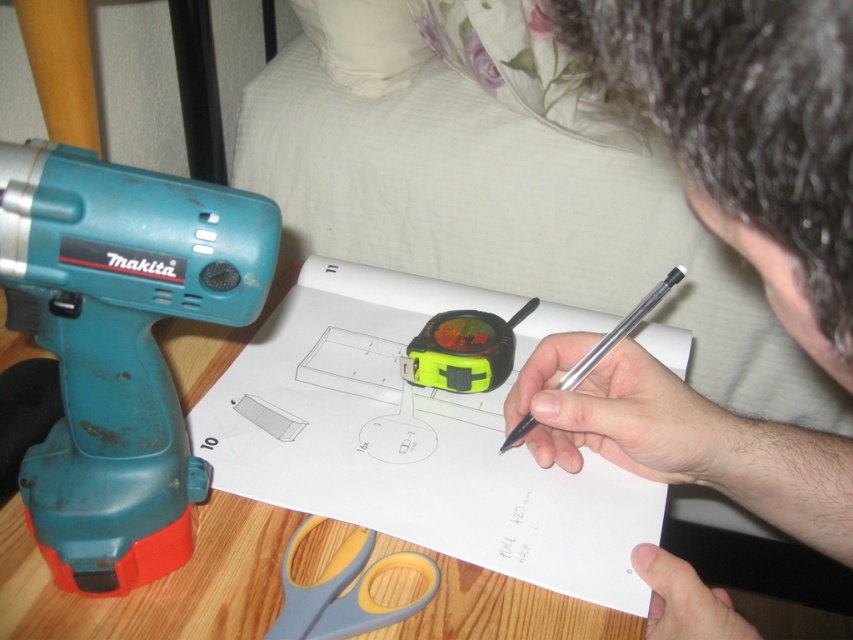
Which of these two, dark brown hair at upper right or yellow-green plastic tape measure at center, stands shorter?

yellow-green plastic tape measure at center

Consider the image. Which is more to the right, dark brown hair at upper right or yellow-green plastic tape measure at center?

Positioned to the right is dark brown hair at upper right.

What do you see at coordinates (747, 134) in the screenshot? I see `dark brown hair at upper right` at bounding box center [747, 134].

Identify the location of dark brown hair at upper right. The width and height of the screenshot is (853, 640). (747, 134).

Who is higher up, yellow/grey plastic scissors at lower left or silver metallic pen at center?

Positioned higher is silver metallic pen at center.

Who is positioned more to the left, yellow/grey plastic scissors at lower left or silver metallic pen at center?

From the viewer's perspective, yellow/grey plastic scissors at lower left appears more on the left side.

Image resolution: width=853 pixels, height=640 pixels. Find the location of `yellow/grey plastic scissors at lower left`. yellow/grey plastic scissors at lower left is located at coordinates (343, 588).

Is yellow/grey plastic scissors at lower left taller than yellow-green plastic tape measure at center?

No, yellow/grey plastic scissors at lower left is not taller than yellow-green plastic tape measure at center.

Who is more distant from viewer, [315,588] or [433,326]?

The point [433,326] is behind.

Locate an element on the screen. yellow/grey plastic scissors at lower left is located at coordinates (343, 588).